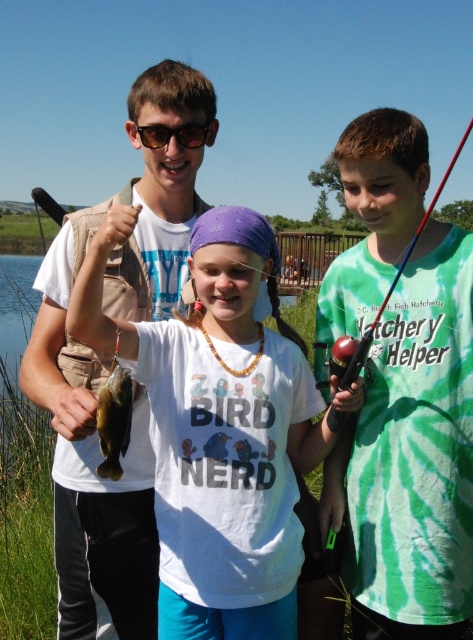
Where is the matte brown vest at upper left located in the image?

The matte brown vest at upper left is located at coordinates point (103, 369).

Looking at this image, you are a photographer trying to capture the scene of the white matte shirt at center and the shiny green fish at center. If you want to ensure both are fully visible in your shot, which object should you consider the width of when framing your photo?

The white matte shirt at center might be wider than the shiny green fish at center, so you should consider the width of the white matte shirt at center to ensure both are fully visible in your photo.